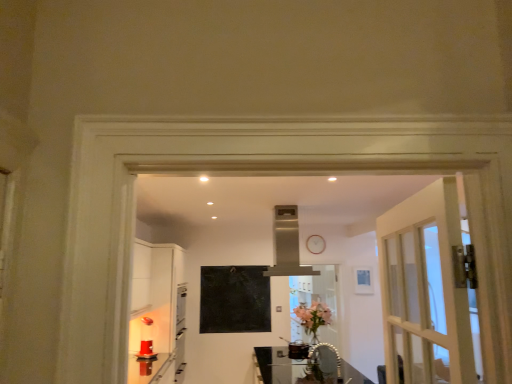
Question: Does pink glass vase at center come in front of clear glass table at center?

Choices:
 (A) yes
 (B) no

Answer: (B)

Question: Is pink glass vase at center positioned far away from clear glass table at center?

Choices:
 (A) no
 (B) yes

Answer: (A)

Question: Is the surface of pink glass vase at center in direct contact with clear glass table at center?

Choices:
 (A) yes
 (B) no

Answer: (B)

Question: Is pink glass vase at center facing towards clear glass table at center?

Choices:
 (A) no
 (B) yes

Answer: (A)

Question: Can you confirm if pink glass vase at center is shorter than clear glass table at center?

Choices:
 (A) yes
 (B) no

Answer: (B)

Question: Is the depth of pink glass vase at center greater than that of clear glass table at center?

Choices:
 (A) yes
 (B) no

Answer: (A)

Question: Is pink glass vase at center at the right side of clear glass screen door at center?

Choices:
 (A) yes
 (B) no

Answer: (B)

Question: From a real-world perspective, is pink glass vase at center below clear glass screen door at center?

Choices:
 (A) no
 (B) yes

Answer: (A)

Question: Is pink glass vase at center in front of clear glass screen door at center?

Choices:
 (A) no
 (B) yes

Answer: (B)

Question: From the image's perspective, is pink glass vase at center below clear glass screen door at center?

Choices:
 (A) no
 (B) yes

Answer: (A)

Question: From the image's perspective, is pink glass vase at center on top of clear glass screen door at center?

Choices:
 (A) no
 (B) yes

Answer: (B)

Question: Does pink glass vase at center lie behind clear glass screen door at center?

Choices:
 (A) no
 (B) yes

Answer: (A)

Question: Is clear glass screen door at center next to matte black bulletin board at center and touching it?

Choices:
 (A) no
 (B) yes

Answer: (A)